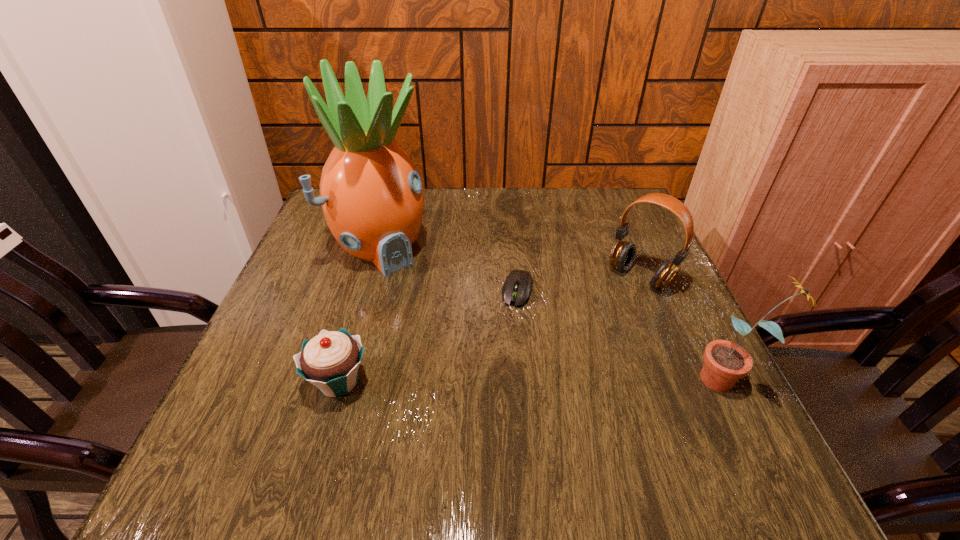
Where is `free space located 0.320m at the entrance of the tallest object`? This screenshot has height=540, width=960. free space located 0.320m at the entrance of the tallest object is located at coordinates (481, 357).

This screenshot has width=960, height=540. Find the location of `vacant area located at the entrance of the tallest object`. vacant area located at the entrance of the tallest object is located at coordinates (442, 313).

Where is `free point located 0.140m at the entrance of the tallest object`? free point located 0.140m at the entrance of the tallest object is located at coordinates (434, 305).

The image size is (960, 540). In order to click on vacant space located 0.400m on the ear cups of the headset in this screenshot , I will do `click(515, 407)`.

This screenshot has height=540, width=960. I want to click on free space located 0.260m on the ear cups of the headset, so click(560, 360).

The width and height of the screenshot is (960, 540). Find the location of `vacant space located on the ear cups of the headset`. vacant space located on the ear cups of the headset is located at coordinates (518, 403).

Locate an element on the screen. vacant area located 0.160m on the wheel side of the computer mouse is located at coordinates (498, 365).

The height and width of the screenshot is (540, 960). I want to click on vacant area located 0.110m on the wheel side of the computer mouse, so click(504, 346).

Find the location of a particular element. The width and height of the screenshot is (960, 540). free space located 0.120m on the wheel side of the computer mouse is located at coordinates (503, 349).

Locate an element on the screen. The width and height of the screenshot is (960, 540). object positioned at the far edge is located at coordinates (372, 197).